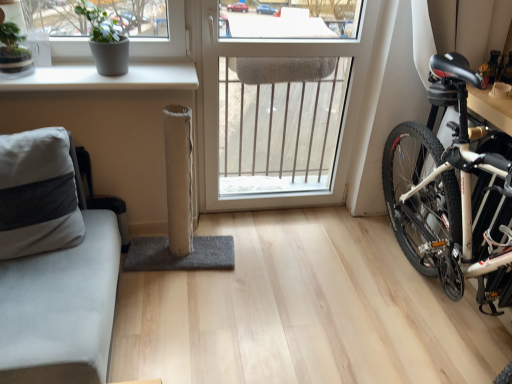
The height and width of the screenshot is (384, 512). I want to click on white matte window sill at upper left, so click(106, 78).

What do you see at coordinates (105, 41) in the screenshot?
I see `gray matte pot at upper left` at bounding box center [105, 41].

At what (x,y) coordinates should I click in order to perform the action: click on white plastic window at center. Please return your answer as a coordinate pair (x, y). Image resolution: width=512 pixels, height=384 pixels. Looking at the image, I should click on (283, 105).

Locate an element on the screen. The height and width of the screenshot is (384, 512). gray fabric couch at left is located at coordinates pos(53,265).

From a real-world perspective, who is located higher, gray matte pot at upper left or white matte window sill at upper left?

gray matte pot at upper left, from a real-world perspective.

Measure the distance from gray matte pot at upper left to white matte window sill at upper left.

The distance of gray matte pot at upper left from white matte window sill at upper left is 6.11 inches.

Is gray matte pot at upper left facing towards white matte window sill at upper left?

No, gray matte pot at upper left is not turned towards white matte window sill at upper left.

Looking at this image, can you confirm if gray matte pot at upper left is smaller than white matte window sill at upper left?

Yes, gray matte pot at upper left is smaller than white matte window sill at upper left.

Looking at this image, which object is wider, gray fabric couch at left or white plastic window at center?

gray fabric couch at left is wider.

Locate an element on the screen. The height and width of the screenshot is (384, 512). studio couch below the white plastic window at center (from the image's perspective) is located at coordinates (53, 265).

Is gray fabric couch at left taller than white plastic window at center?

No, gray fabric couch at left is not taller than white plastic window at center.

Measure the distance between gray fabric couch at left and white plastic window at center.

A distance of 4.15 feet exists between gray fabric couch at left and white plastic window at center.

From the image's perspective, which is above, white plastic window at center or gray matte pot at upper left?

gray matte pot at upper left appears higher in the image.

Is white plastic window at center not within gray matte pot at upper left?

Yes, white plastic window at center is outside of gray matte pot at upper left.

Can you see white plastic window at center touching gray matte pot at upper left?

No, white plastic window at center is not with gray matte pot at upper left.

From a real-world perspective, which is physically below, white matte window sill at upper left or white plastic window at center?

From a 3D spatial view, white plastic window at center is below.

In order to click on window sill above the white plastic window at center (from a real-world perspective) in this screenshot , I will do click(x=106, y=78).

Is the depth of white matte window sill at upper left greater than that of white plastic window at center?

No, the depth of white matte window sill at upper left is less than that of white plastic window at center.

Does white matte window sill at upper left have a smaller size compared to white plastic window at center?

Yes, white matte window sill at upper left is smaller than white plastic window at center.

Can you confirm if gray matte pot at upper left is shorter than white plastic window at center?

Correct, gray matte pot at upper left is not as tall as white plastic window at center.

Can you confirm if gray matte pot at upper left is thinner than white plastic window at center?

Incorrect, the width of gray matte pot at upper left is not less than that of white plastic window at center.

Consider the image. From the image's perspective, is gray matte pot at upper left beneath white plastic window at center?

No, from the image's perspective, gray matte pot at upper left is not beneath white plastic window at center.

Is point (100, 23) in front of point (315, 114)?

Yes.

From a real-world perspective, does gray fabric couch at left stand above white matte window sill at upper left?

Incorrect, from a real-world perspective, gray fabric couch at left is lower than white matte window sill at upper left.

Between gray fabric couch at left and white matte window sill at upper left, which one has more height?

gray fabric couch at left is taller.

Can you tell me how much gray fabric couch at left and white matte window sill at upper left differ in facing direction?

The angular difference between gray fabric couch at left and white matte window sill at upper left is 0.0286 degrees.

Does white plastic window at center have a smaller size compared to gray fabric couch at left?

Yes, white plastic window at center is smaller than gray fabric couch at left.

The width and height of the screenshot is (512, 384). Identify the location of studio couch in front of the white plastic window at center. (53, 265).

Is white plastic window at center outside of gray fabric couch at left?

Yes.

The width and height of the screenshot is (512, 384). I want to click on houseplant above the white matte window sill at upper left (from a real-world perspective), so click(x=105, y=41).

The height and width of the screenshot is (384, 512). Find the location of `window to the right of gray fabric couch at left`. window to the right of gray fabric couch at left is located at coordinates (283, 105).

Looking at the image, which one is located closer to gray fabric couch at left, white matte window sill at upper left or white plastic window at center?

white matte window sill at upper left.

Which object lies nearer to the anchor point white matte window sill at upper left, gray fabric couch at left or white plastic window at center?

gray fabric couch at left is positioned closer to the anchor white matte window sill at upper left.

Looking at the image, which one is located closer to gray fabric couch at left, white plastic window at center or white matte window sill at upper left?

white matte window sill at upper left.

Looking at the image, which one is located closer to white matte window sill at upper left, white plastic window at center or gray matte pot at upper left?

Based on the image, gray matte pot at upper left appears to be nearer to white matte window sill at upper left.

Estimate the real-world distances between objects in this image. Which object is closer to white plastic window at center, gray matte pot at upper left or white matte window sill at upper left?

white matte window sill at upper left is closer to white plastic window at center.

Estimate the real-world distances between objects in this image. Which object is closer to white plastic window at center, white matte window sill at upper left or gray fabric couch at left?

white matte window sill at upper left.

Estimate the real-world distances between objects in this image. Which object is closer to gray matte pot at upper left, white matte window sill at upper left or white plastic window at center?

Among the two, white matte window sill at upper left is located nearer to gray matte pot at upper left.

When comparing their distances from gray matte pot at upper left, does gray fabric couch at left or white matte window sill at upper left seem closer?

white matte window sill at upper left is closer to gray matte pot at upper left.

The height and width of the screenshot is (384, 512). I want to click on window sill between gray matte pot at upper left and gray fabric couch at left vertically, so click(x=106, y=78).

The width and height of the screenshot is (512, 384). What are the coordinates of `houseplant between white matte window sill at upper left and white plastic window at center in the horizontal direction` in the screenshot? It's located at (105, 41).

At what (x,y) coordinates should I click in order to perform the action: click on houseplant positioned between gray fabric couch at left and white plastic window at center from near to far. Please return your answer as a coordinate pair (x, y). Looking at the image, I should click on (105, 41).

Identify the location of window sill between gray fabric couch at left and white plastic window at center from front to back. Image resolution: width=512 pixels, height=384 pixels. (106, 78).